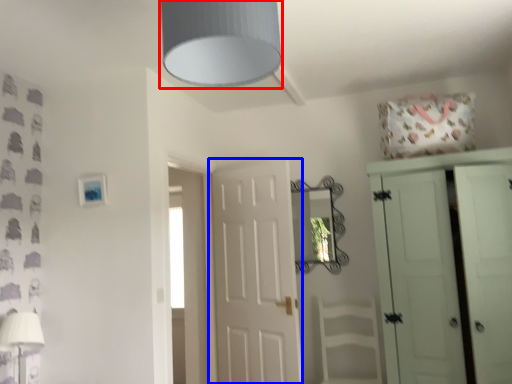
Question: Among these objects, which one is nearest to the camera, light fixture (highlighted by a red box) or door (highlighted by a blue box)?

Choices:
 (A) light fixture
 (B) door

Answer: (A)